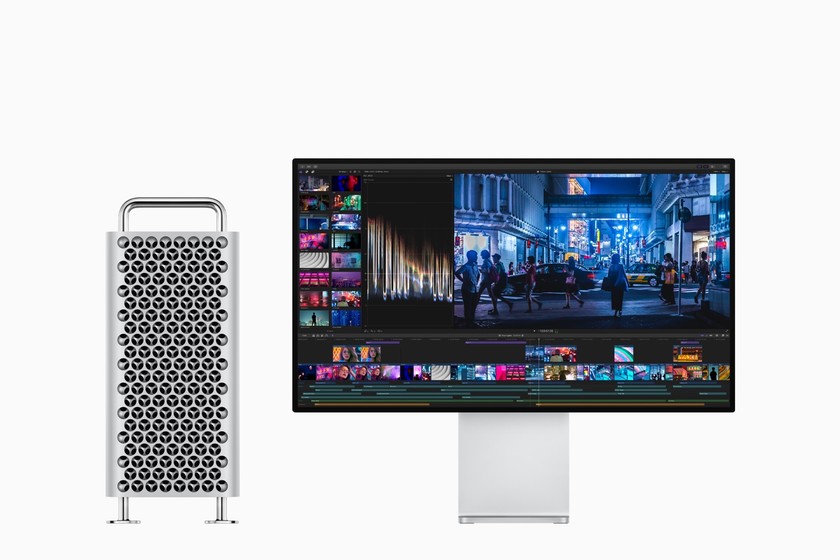
What are the coordinates of `metal legs` in the screenshot? It's located at (218, 515), (123, 519).